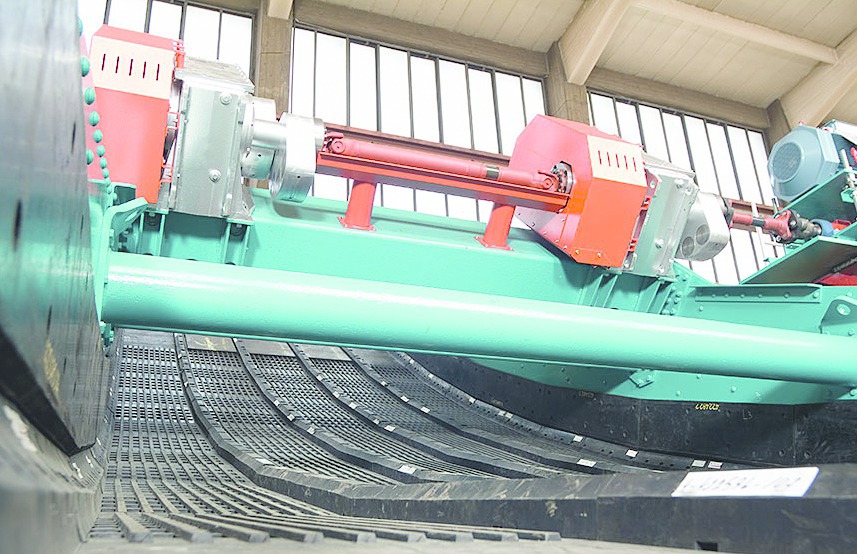
At what (x,y) coordinates should I click in order to perform the action: click on window. Please return your answer as a coordinate pair (x, y). The height and width of the screenshot is (554, 857). Looking at the image, I should click on (424, 88).